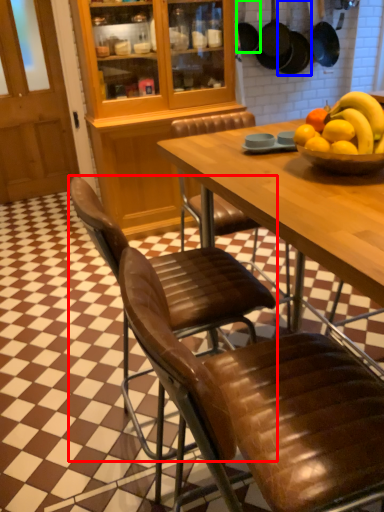
Question: Based on their relative distances, which object is farther from chair (highlighted by a red box)? Choose from frying pan (highlighted by a blue box) and frying pan (highlighted by a green box).

Choices:
 (A) frying pan
 (B) frying pan

Answer: (A)